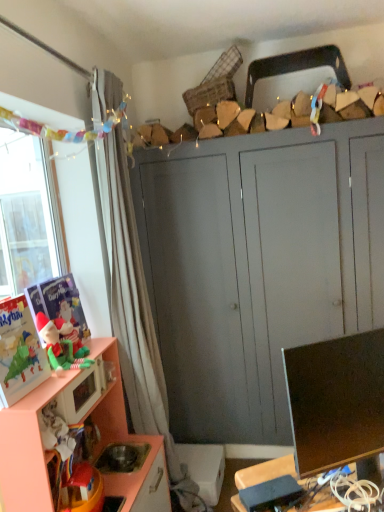
Question: Visually, is matte black monitor at lower right positioned to the left or to the right of white sheer curtain at left?

Choices:
 (A) right
 (B) left

Answer: (A)

Question: From the image's perspective, is matte black monitor at lower right located above or below white sheer curtain at left?

Choices:
 (A) below
 (B) above

Answer: (A)

Question: Which object is positioned closest to the peach wood cabinet at lower left, the first cabinetry viewed from the front?

Choices:
 (A) matte plastic toy at left, placed as the first toy when sorted from back to front
 (B) matte black monitor at lower right
 (C) white sheer curtain at left
 (D) matte gray cabinet at center, which is counted as the 1th cabinetry, starting from the back
 (E) matte pink microwave at lower left

Answer: (E)

Question: Which of these objects is positioned closest to the matte green plush elf at left, arranged as the second toy when viewed from the back?

Choices:
 (A) peach wood cabinet at lower left, the first cabinetry viewed from the front
 (B) matte plastic toy at left, placed as the first toy when sorted from back to front
 (C) white sheer curtain at left
 (D) matte black monitor at lower right
 (E) matte pink microwave at lower left

Answer: (B)